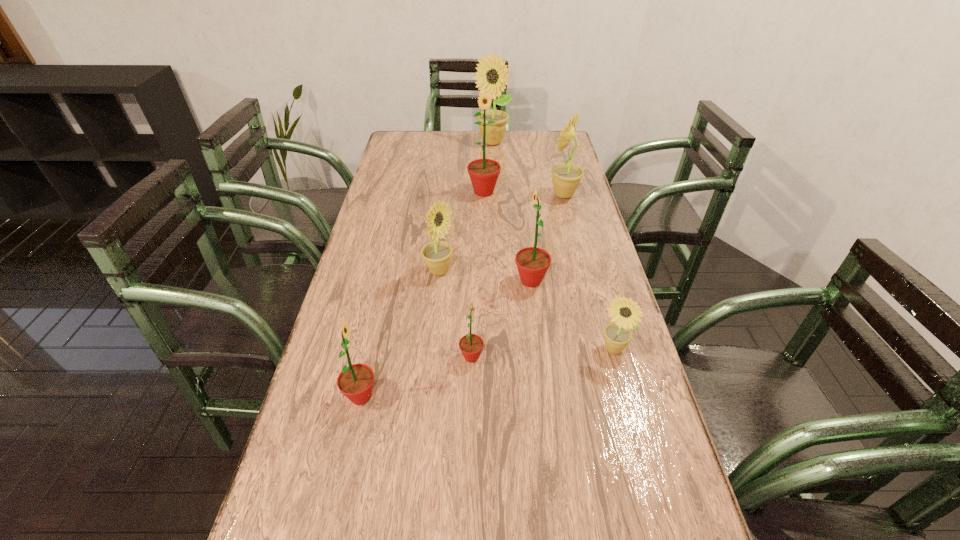
Image resolution: width=960 pixels, height=540 pixels. I want to click on vacant region that satisfies the following two spatial constraints: 1. on the face of the second yellow sunflower from left to right; 2. on the face of the second sunflower from left to right, so click(x=497, y=271).

The height and width of the screenshot is (540, 960). I want to click on vacant space that satisfies the following two spatial constraints: 1. on the face of the second yellow sunflower from left to right; 2. on the face of the third farthest green sunflower, so click(x=501, y=357).